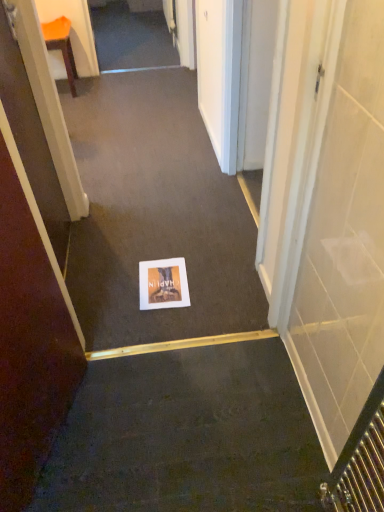
Question: Is the surface of white paper at center in direct contact with orange plastic chair at upper left?

Choices:
 (A) no
 (B) yes

Answer: (A)

Question: Are white paper at center and orange plastic chair at upper left located far from each other?

Choices:
 (A) no
 (B) yes

Answer: (B)

Question: Considering the relative positions of white paper at center and orange plastic chair at upper left in the image provided, is white paper at center to the left of orange plastic chair at upper left from the viewer's perspective?

Choices:
 (A) no
 (B) yes

Answer: (A)

Question: Can you confirm if white paper at center is smaller than orange plastic chair at upper left?

Choices:
 (A) yes
 (B) no

Answer: (B)

Question: Is white paper at center shorter than orange plastic chair at upper left?

Choices:
 (A) yes
 (B) no

Answer: (A)

Question: From the image's perspective, relative to orange plastic chair at upper left, is white paper at center above or below?

Choices:
 (A) above
 (B) below

Answer: (B)

Question: Considering the positions of white paper at center and orange plastic chair at upper left in the image, is white paper at center bigger or smaller than orange plastic chair at upper left?

Choices:
 (A) big
 (B) small

Answer: (A)

Question: Is white paper at center taller or shorter than orange plastic chair at upper left?

Choices:
 (A) tall
 (B) short

Answer: (B)

Question: Considering their positions, is white paper at center located in front of or behind orange plastic chair at upper left?

Choices:
 (A) behind
 (B) front

Answer: (B)

Question: Looking at the image, does brown matte door at lower left seem bigger or smaller compared to orange plastic chair at upper left?

Choices:
 (A) big
 (B) small

Answer: (A)

Question: Considering the positions of point (19, 412) and point (72, 59), is point (19, 412) closer or farther from the camera than point (72, 59)?

Choices:
 (A) closer
 (B) farther

Answer: (A)

Question: From a real-world perspective, relative to orange plastic chair at upper left, is brown matte door at lower left vertically above or below?

Choices:
 (A) above
 (B) below

Answer: (A)

Question: From their relative heights in the image, would you say brown matte door at lower left is taller or shorter than orange plastic chair at upper left?

Choices:
 (A) tall
 (B) short

Answer: (A)

Question: In terms of height, does matte paper postcard at center look taller or shorter compared to orange plastic chair at upper left?

Choices:
 (A) short
 (B) tall

Answer: (A)

Question: From the image's perspective, relative to orange plastic chair at upper left, is matte paper postcard at center above or below?

Choices:
 (A) below
 (B) above

Answer: (A)